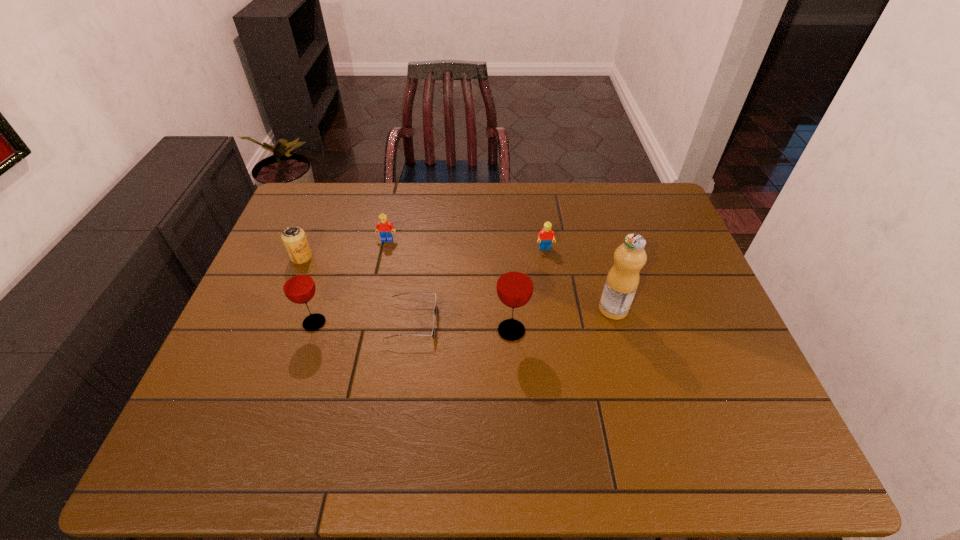
Identify the location of vacant area between the farthest object and the beer can. pos(345,248).

Locate an element on the screen. This screenshot has height=540, width=960. unoccupied area between the sixth object from right to left and the third object from left to right is located at coordinates (350, 281).

Find the location of a particular element. Image resolution: width=960 pixels, height=540 pixels. free space between the farther Lego and the right glass is located at coordinates (449, 285).

Image resolution: width=960 pixels, height=540 pixels. Identify the location of blank region between the left Lego and the nearer Lego. (466, 244).

At what (x,y) coordinates should I click in order to perform the action: click on free point between the left glass and the left Lego. Please return your answer as a coordinate pair (x, y). Looking at the image, I should click on (350, 281).

At what (x,y) coordinates should I click in order to perform the action: click on vacant space in between the farther Lego and the fourth object from right to left. Please return your answer as a coordinate pair (x, y). The height and width of the screenshot is (540, 960). Looking at the image, I should click on (399, 281).

Locate an element on the screen. This screenshot has height=540, width=960. vacant area that lies between the rightmost object and the left glass is located at coordinates (464, 316).

At what (x,y) coordinates should I click in order to perform the action: click on free spot between the taller glass and the shorter glass. Please return your answer as a coordinate pair (x, y). Image resolution: width=960 pixels, height=540 pixels. Looking at the image, I should click on (413, 327).

Locate an element on the screen. object that stands as the sixth closest to the rightmost object is located at coordinates (294, 238).

Locate an element on the screen. The width and height of the screenshot is (960, 540). object that is the nearest to the fourth object from right to left is located at coordinates (515, 282).